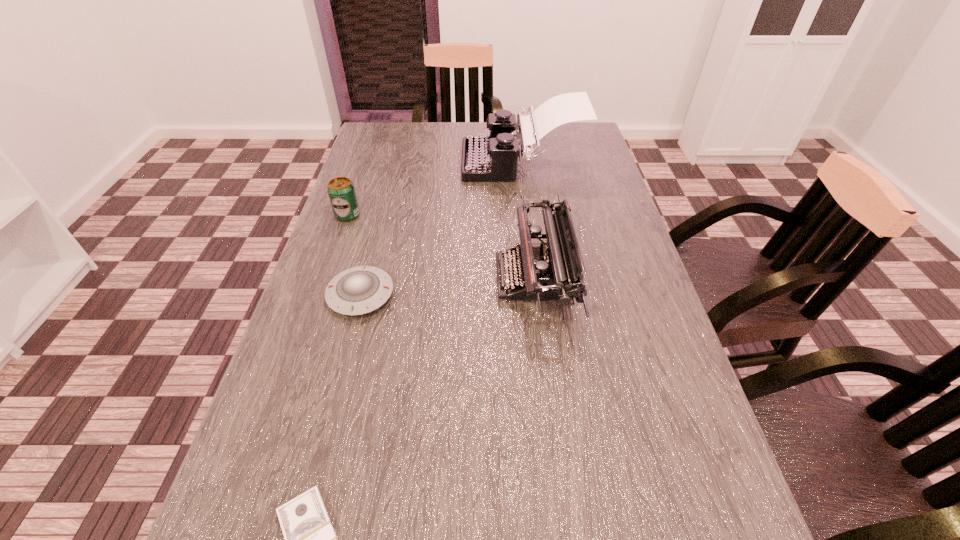
You are a GUI agent. You are given a task and a screenshot of the screen. Output one action in this format:
    pyautogui.click(x=<x>, y=<y>)
    Task: Click on the object that is the second closest one to the tallest object
    
    Given the screenshot: What is the action you would take?
    pyautogui.click(x=341, y=191)

The image size is (960, 540). I want to click on free space that satisfies the following two spatial constraints: 1. on the keys of the farther typewriter; 2. on the front side of the second farthest object, so click(x=528, y=215).

Locate an element on the screen. The image size is (960, 540). blank area in the image that satisfies the following two spatial constraints: 1. on the typing side of the nearer typewriter; 2. on the front side of the saucer is located at coordinates (536, 295).